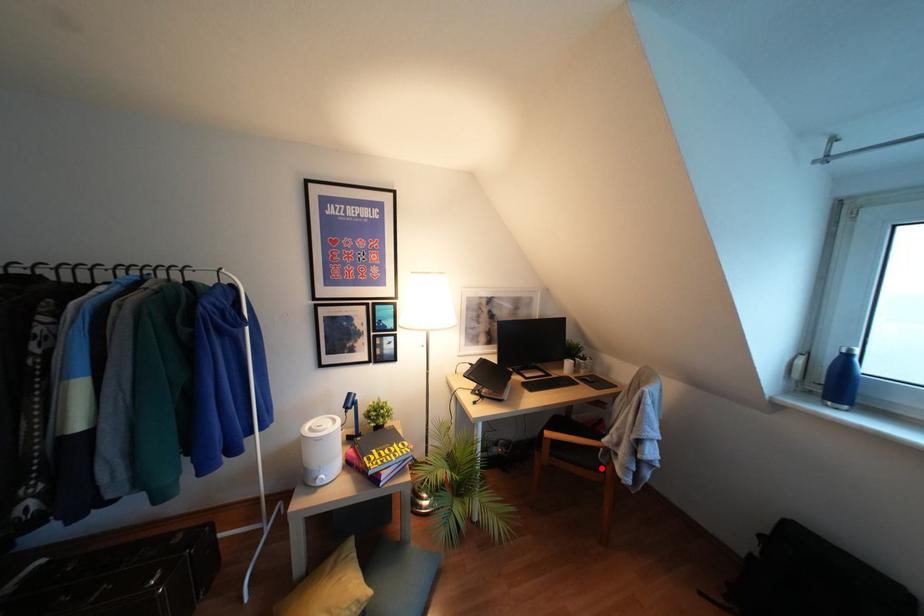
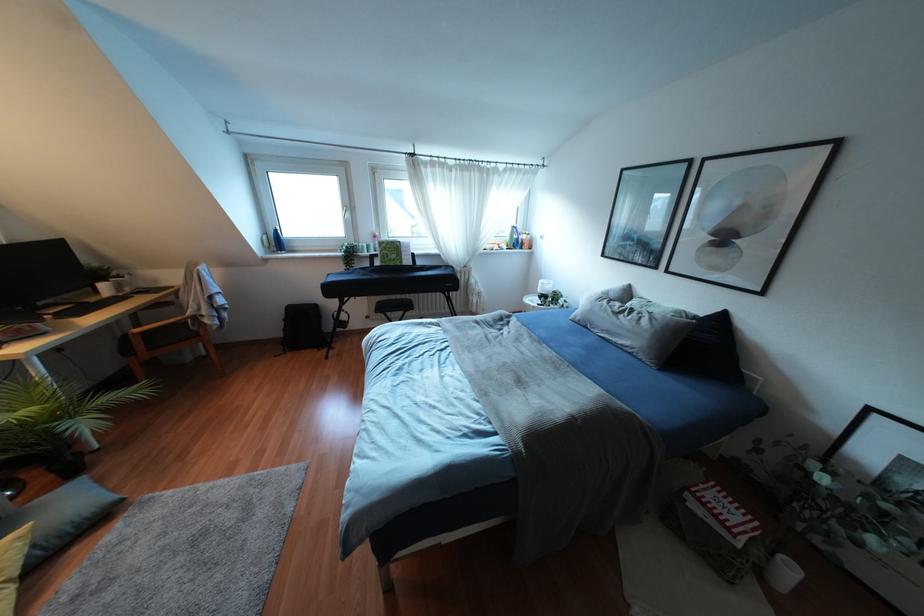
The point at the highlighted location is marked in the first image. Where is the corresponding point in the second image?

(196, 334)